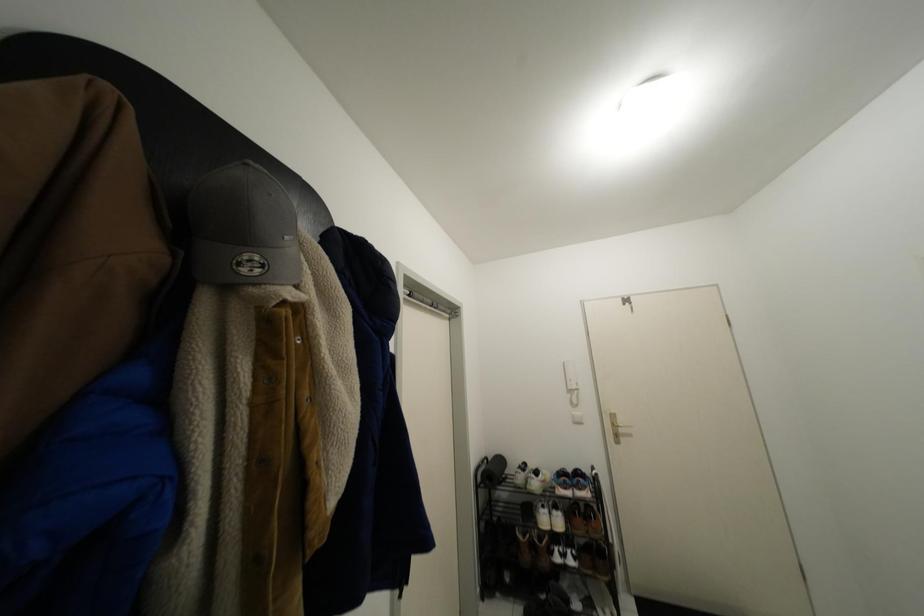
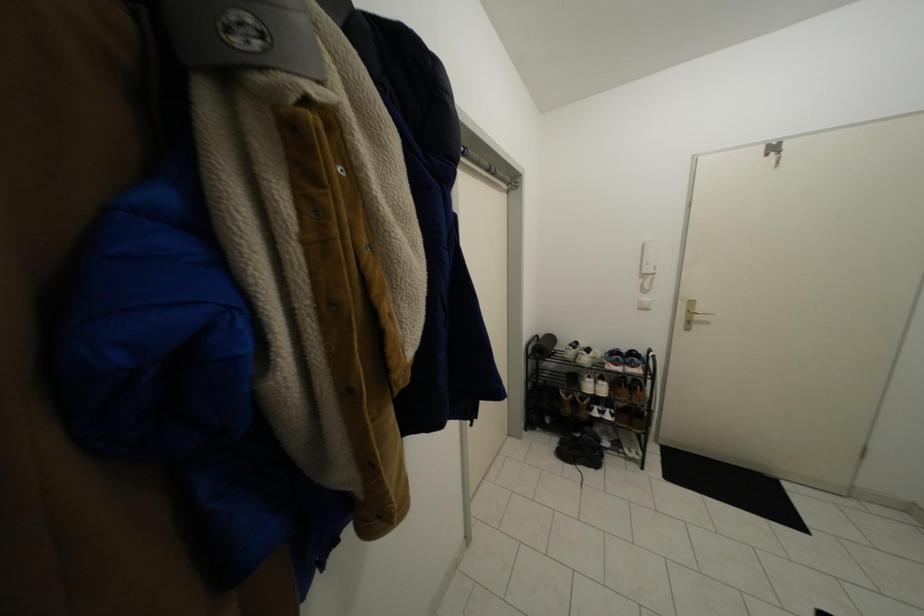
Question: How did the camera likely rotate?

Choices:
 (A) Left
 (B) Right
 (C) Up
 (D) Down

Answer: (D)